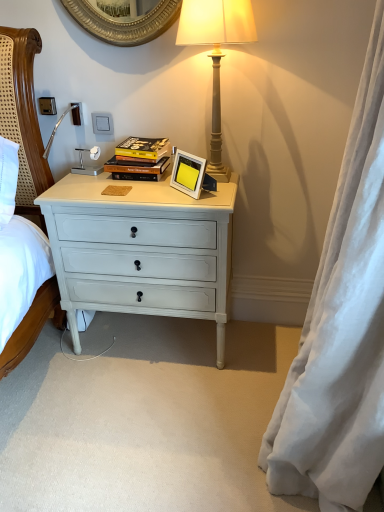
Question: Is hardcover book at center to the left of white silky curtain at right from the viewer's perspective?

Choices:
 (A) no
 (B) yes

Answer: (B)

Question: Is hardcover book at center placed right next to white silky curtain at right?

Choices:
 (A) no
 (B) yes

Answer: (A)

Question: From a real-world perspective, is hardcover book at center under white silky curtain at right?

Choices:
 (A) no
 (B) yes

Answer: (A)

Question: Does hardcover book at center have a larger size compared to white silky curtain at right?

Choices:
 (A) yes
 (B) no

Answer: (B)

Question: Does hardcover book at center have a lesser height compared to white silky curtain at right?

Choices:
 (A) yes
 (B) no

Answer: (A)

Question: From the image's perspective, would you say hardcover book at center is shown under white silky curtain at right?

Choices:
 (A) no
 (B) yes

Answer: (A)

Question: Could you tell me if white plastic power outlet at upper left, arranged as the second power outlet when viewed from the right, is facing matte beige lamp at upper right?

Choices:
 (A) no
 (B) yes

Answer: (A)

Question: Considering the relative sizes of white plastic power outlet at upper left, arranged as the 2th power outlet when viewed from the left, and matte beige lamp at upper right in the image provided, is white plastic power outlet at upper left, arranged as the 2th power outlet when viewed from the left, thinner than matte beige lamp at upper right?

Choices:
 (A) no
 (B) yes

Answer: (B)

Question: Is white plastic power outlet at upper left, arranged as the second power outlet when viewed from the right, behind matte beige lamp at upper right?

Choices:
 (A) no
 (B) yes

Answer: (B)

Question: From a real-world perspective, is white plastic power outlet at upper left, arranged as the 2th power outlet when viewed from the left, over matte beige lamp at upper right?

Choices:
 (A) yes
 (B) no

Answer: (B)

Question: Is white plastic power outlet at upper left, arranged as the 2th power outlet when viewed from the left, positioned before matte beige lamp at upper right?

Choices:
 (A) yes
 (B) no

Answer: (B)

Question: Is matte beige lamp at upper right at the back of white plastic power outlet at upper left, arranged as the 2th power outlet when viewed from the left?

Choices:
 (A) yes
 (B) no

Answer: (B)

Question: Is white painted wood drawer at center behind hardcover book at center?

Choices:
 (A) yes
 (B) no

Answer: (B)